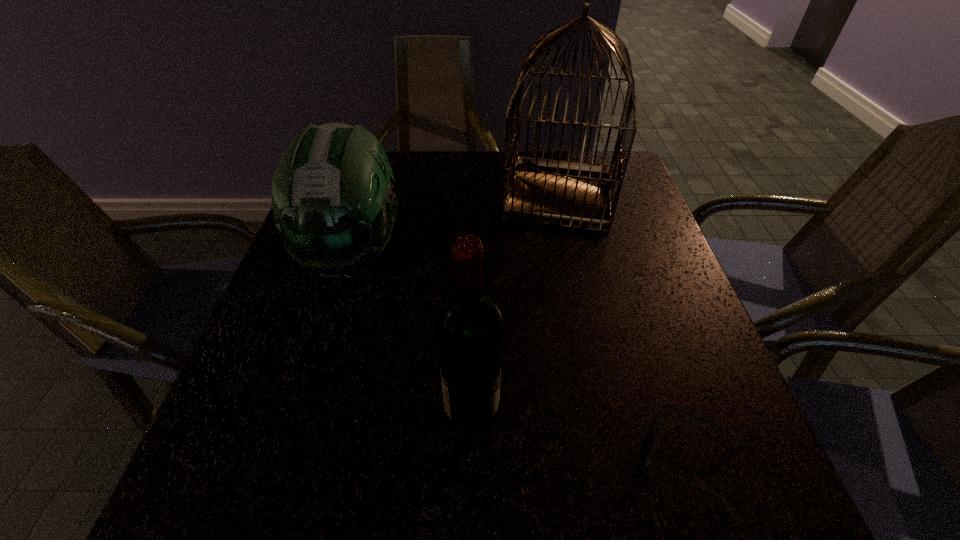
This screenshot has height=540, width=960. I want to click on free region at the near edge, so click(x=620, y=511).

Locate an element on the screen. The image size is (960, 540). free location at the left edge is located at coordinates (239, 453).

The image size is (960, 540). I want to click on vacant space at the right edge, so click(x=630, y=213).

In order to click on vacant position at the far right corner of the desktop in this screenshot , I will do `click(637, 196)`.

At what (x,y) coordinates should I click in order to perform the action: click on free spot between the football helmet and the alcohol. Please return your answer as a coordinate pair (x, y). This screenshot has height=540, width=960. Looking at the image, I should click on (413, 332).

The image size is (960, 540). I want to click on vacant region between the shortest object and the birdcage, so click(625, 327).

Where is `free space between the tallest object and the shortest object`? The width and height of the screenshot is (960, 540). free space between the tallest object and the shortest object is located at coordinates (625, 327).

At what (x,y) coordinates should I click in order to perform the action: click on free area in between the football helmet and the shortest object. Please return your answer as a coordinate pair (x, y). Looking at the image, I should click on (522, 356).

What are the coordinates of `free space between the shortest object and the football helmet` in the screenshot? It's located at 522,356.

Find the location of a particular element. The width and height of the screenshot is (960, 540). free space between the shortest object and the second shortest object is located at coordinates (522, 356).